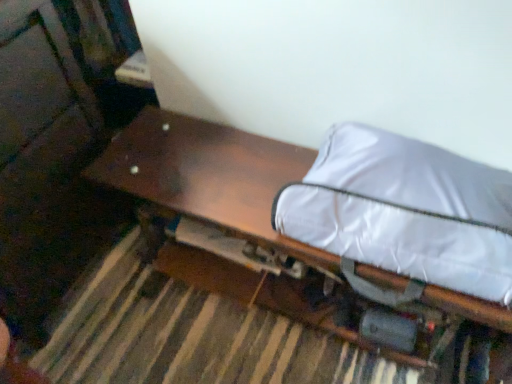
Question: From the image's perspective, is wooden bench at center under white fabric bean bag at right?

Choices:
 (A) yes
 (B) no

Answer: (A)

Question: Does wooden bench at center turn towards white fabric bean bag at right?

Choices:
 (A) no
 (B) yes

Answer: (A)

Question: From a real-world perspective, is wooden bench at center located higher than white fabric bean bag at right?

Choices:
 (A) no
 (B) yes

Answer: (A)

Question: Is the surface of wooden bench at center in direct contact with white fabric bean bag at right?

Choices:
 (A) yes
 (B) no

Answer: (B)

Question: Does wooden bench at center appear on the left side of white fabric bean bag at right?

Choices:
 (A) no
 (B) yes

Answer: (B)

Question: Does wooden bench at center have a larger size compared to white fabric bean bag at right?

Choices:
 (A) no
 (B) yes

Answer: (B)

Question: Is white fabric bean bag at right not within wooden bench at center?

Choices:
 (A) yes
 (B) no

Answer: (A)

Question: Is white fabric bean bag at right far away from wooden bench at center?

Choices:
 (A) yes
 (B) no

Answer: (B)

Question: Is white fabric bean bag at right wider than wooden bench at center?

Choices:
 (A) yes
 (B) no

Answer: (B)

Question: Is white fabric bean bag at right placed right next to wooden bench at center?

Choices:
 (A) yes
 (B) no

Answer: (B)

Question: Is wooden bench at center at the back of white fabric bean bag at right?

Choices:
 (A) no
 (B) yes

Answer: (A)

Question: Can you confirm if white fabric bean bag at right is smaller than wooden bench at center?

Choices:
 (A) yes
 (B) no

Answer: (A)

Question: Which is correct: white fabric bean bag at right is inside wooden bench at center, or outside of it?

Choices:
 (A) outside
 (B) inside

Answer: (A)